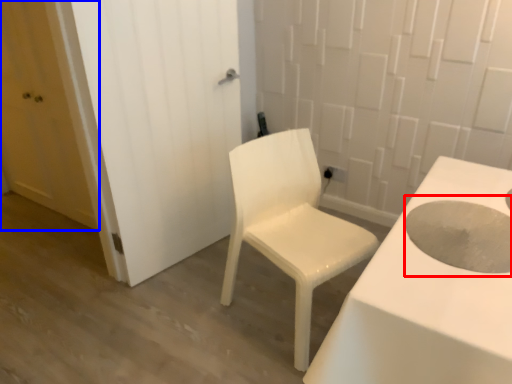
Question: Which of the following is the farthest to the observer, hole (highlighted by a red box) or door (highlighted by a blue box)?

Choices:
 (A) hole
 (B) door

Answer: (B)